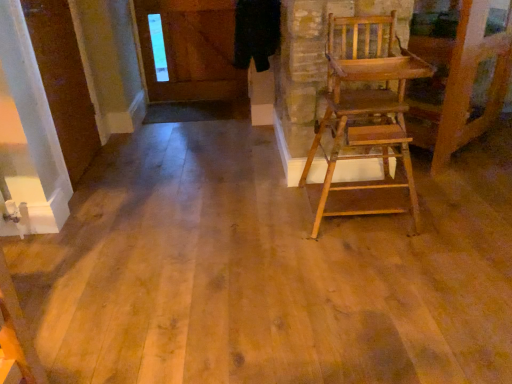
What are the coordinates of `unoccupied area in front of wooden high chair at right` in the screenshot? It's located at (382, 269).